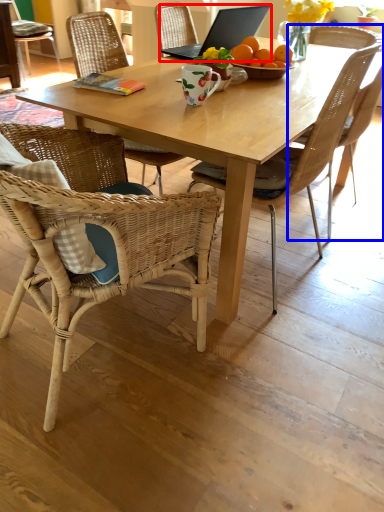
Question: Which of the following is the closest to the observer, laptop (highlighted by a red box) or chair (highlighted by a blue box)?

Choices:
 (A) laptop
 (B) chair

Answer: (B)